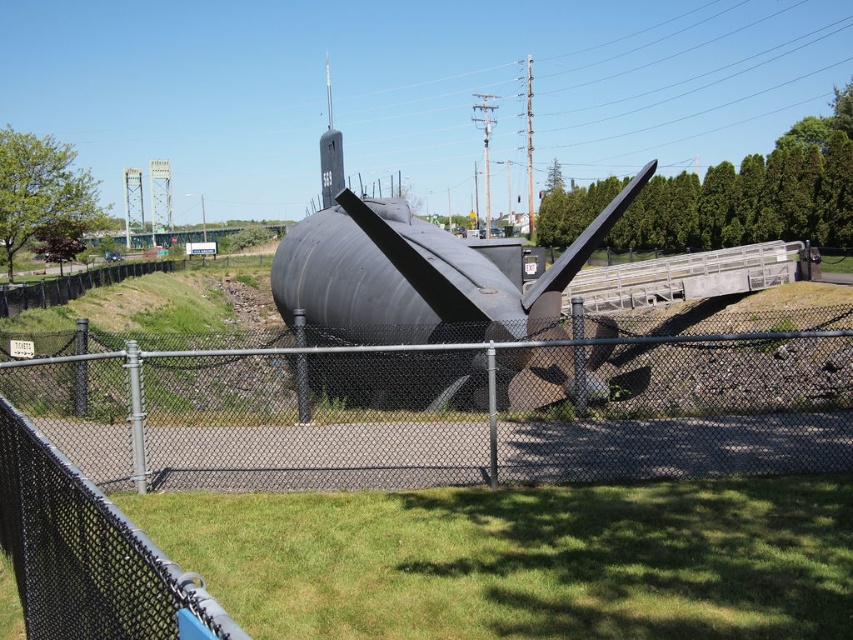
You are standing at the point closest to the submarine. Which point, point (300, 461) or point (462, 252), is closer to the submarine?

Point (300, 461) is in front of point (462, 252), so it is closer to the submarine.